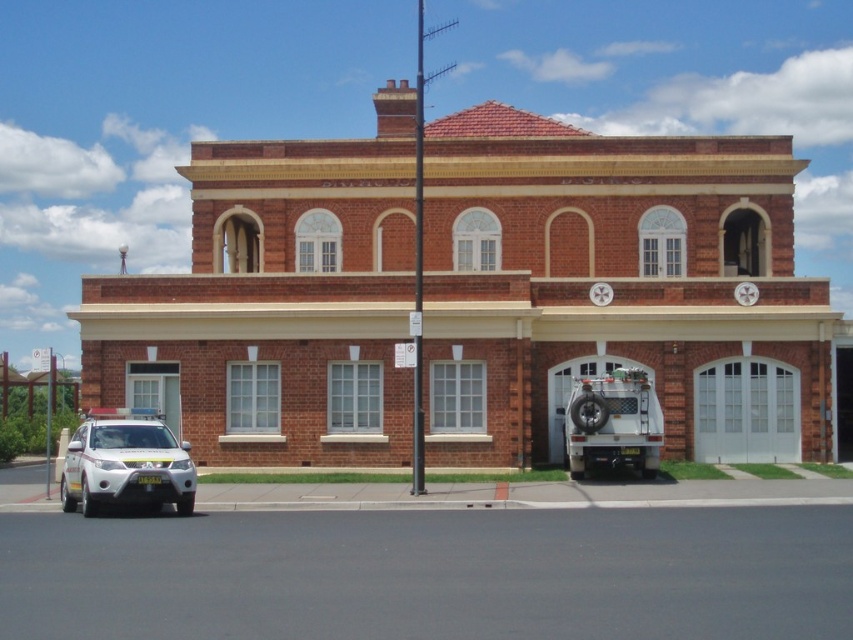
Between brown brick fire station at center and white rubber fire truck at lower right, which one has less height?

white rubber fire truck at lower right

The height and width of the screenshot is (640, 853). I want to click on brown brick fire station at center, so click(x=618, y=289).

This screenshot has height=640, width=853. In order to click on brown brick fire station at center in this screenshot , I will do `click(618, 289)`.

Consider the image. Who is positioned more to the left, brown brick fire station at center or white matte suv at lower left?

white matte suv at lower left is more to the left.

Is brown brick fire station at center to the left of white matte suv at lower left from the viewer's perspective?

No, brown brick fire station at center is not to the left of white matte suv at lower left.

Image resolution: width=853 pixels, height=640 pixels. I want to click on brown brick fire station at center, so click(x=618, y=289).

Can you confirm if white matte suv at lower left is taller than white rubber fire truck at lower right?

Incorrect, white matte suv at lower left's height is not larger of white rubber fire truck at lower right's.

Does white matte suv at lower left appear on the right side of white rubber fire truck at lower right?

No, white matte suv at lower left is not to the right of white rubber fire truck at lower right.

I want to click on white matte suv at lower left, so tap(126, 464).

I want to click on white matte suv at lower left, so 126,464.